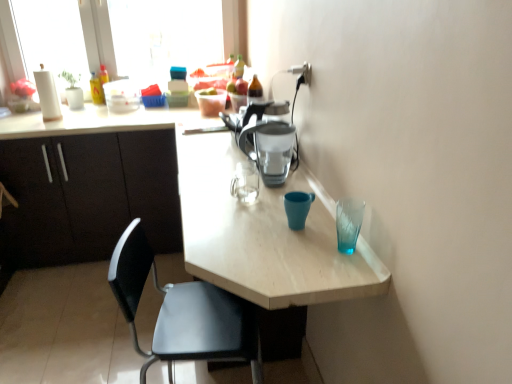
You are a GUI agent. You are given a task and a screenshot of the screen. Output one action in this format:
    pyautogui.click(x=<x>, y=<y>)
    Task: Click on the vacant space underneath matte plastic coffee pot at center (from a real-world perspective)
    The width and height of the screenshot is (512, 384).
    Given the screenshot: What is the action you would take?
    pyautogui.click(x=280, y=182)